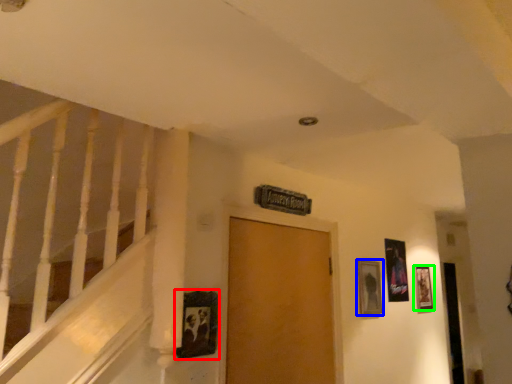
Question: Considering the real-world distances, which object is closest to picture frame (highlighted by a red box)? picture frame (highlighted by a blue box) or picture frame (highlighted by a green box).

Choices:
 (A) picture frame
 (B) picture frame

Answer: (A)